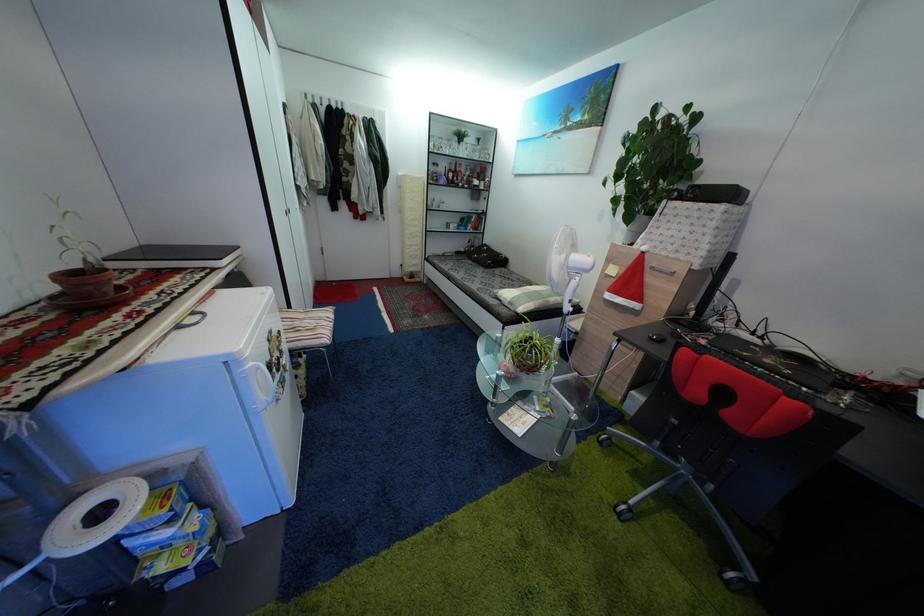
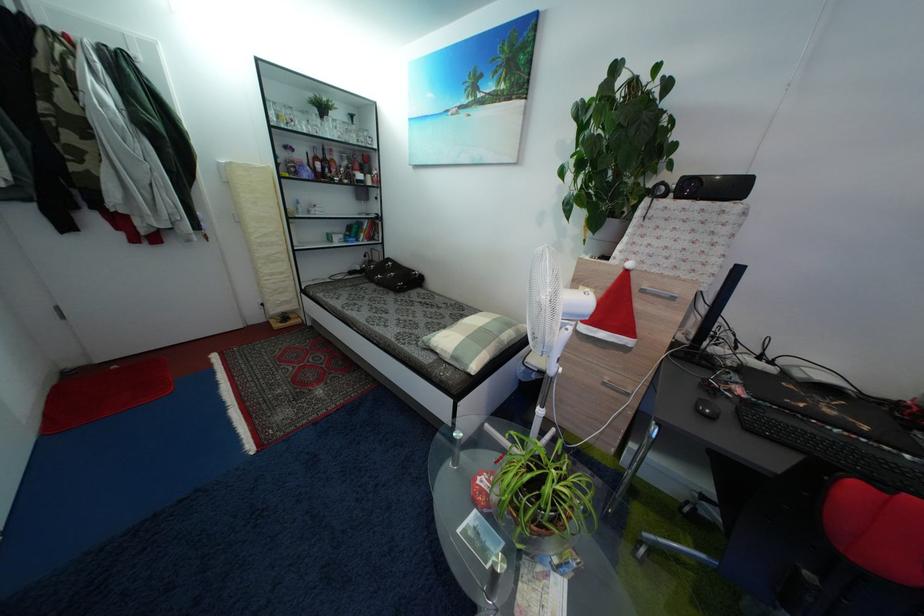
Question: In a continuous first-person perspective shot, in which direction is the camera moving?

Choices:
 (A) Left
 (B) Right
 (C) Forward
 (D) Backward

Answer: (C)